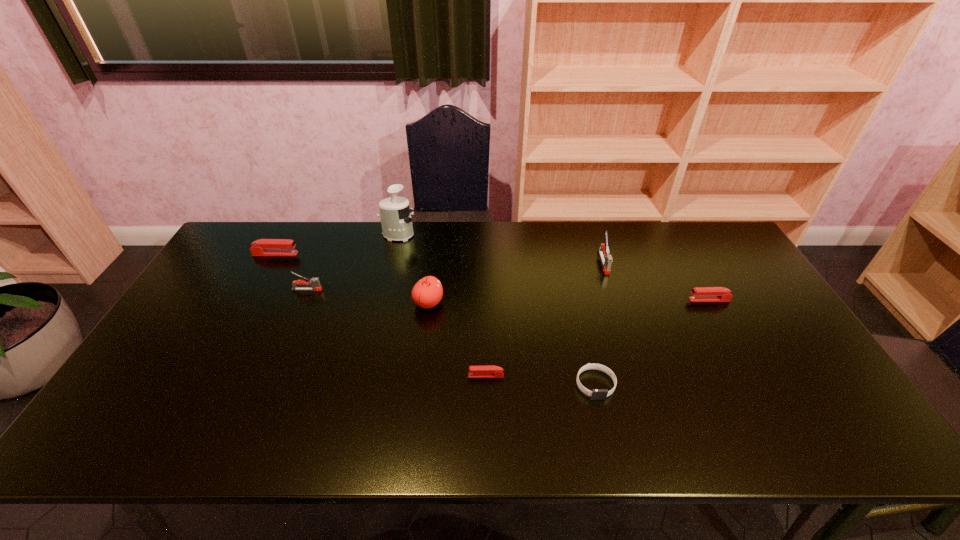
Image resolution: width=960 pixels, height=540 pixels. In order to click on object that is at the far left corner in this screenshot , I will do `click(263, 247)`.

In the image, there is a desktop. Where is `vacant space at the far edge`? This screenshot has height=540, width=960. vacant space at the far edge is located at coordinates (635, 225).

Identify the location of vacant space at the near edge. (571, 447).

In the image, there is a desktop. Identify the location of vacant region at the right edge. This screenshot has height=540, width=960. (763, 302).

In order to click on vacant space at the far left corner of the desktop in this screenshot , I will do `click(262, 222)`.

Locate an element on the screen. The image size is (960, 540). free region at the near left corner is located at coordinates (99, 433).

Identify the location of vacant space in between the nearest red stapler and the fourth object from left to right. (457, 339).

Identify the location of free spot between the farthest object and the apple. (414, 269).

Where is `free point between the second biggest red stapler and the fifth object from right to left`? This screenshot has width=960, height=540. free point between the second biggest red stapler and the fifth object from right to left is located at coordinates (569, 301).

Identify the location of free space between the red apple and the rightmost red stapler. The image size is (960, 540). (569, 301).